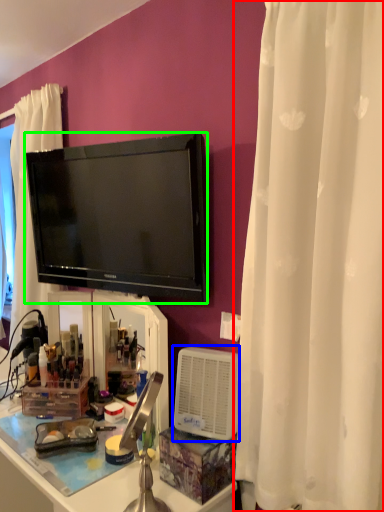
Question: Which object is the closest to the curtain (highlighted by a red box)? Choose among these: appliance (highlighted by a blue box) or television (highlighted by a green box).

Choices:
 (A) appliance
 (B) television

Answer: (A)